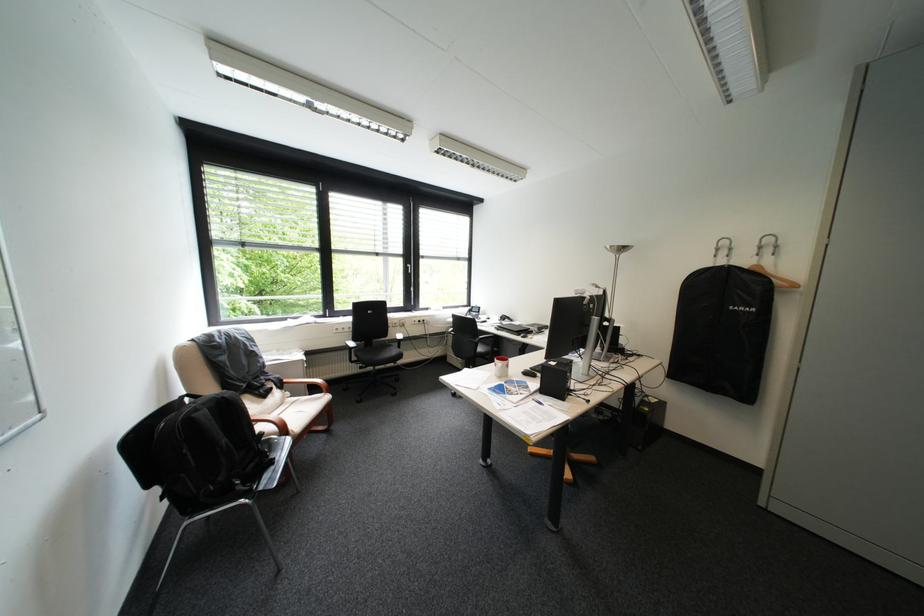
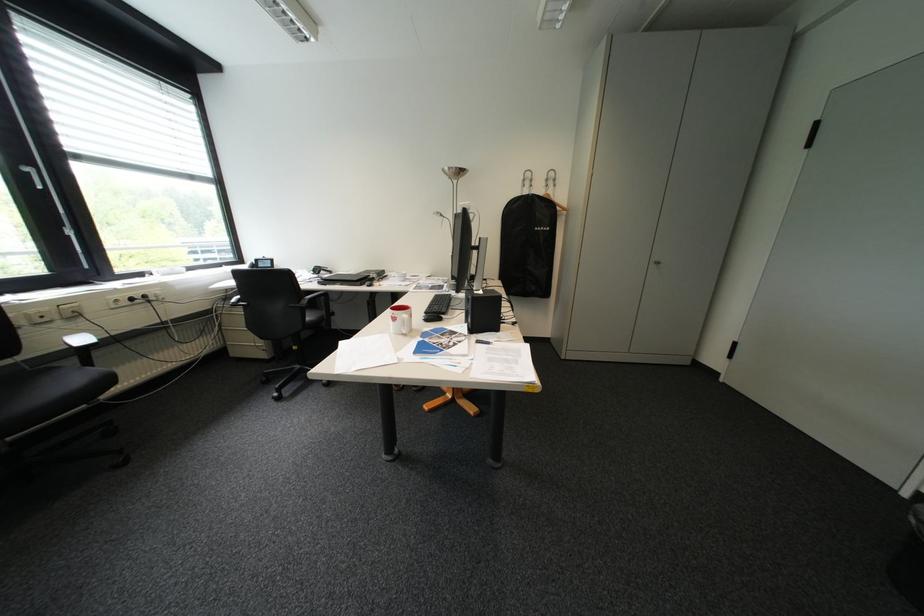
Locate, in the second image, the point that corresponds to (x=507, y=365) in the first image.

(407, 320)